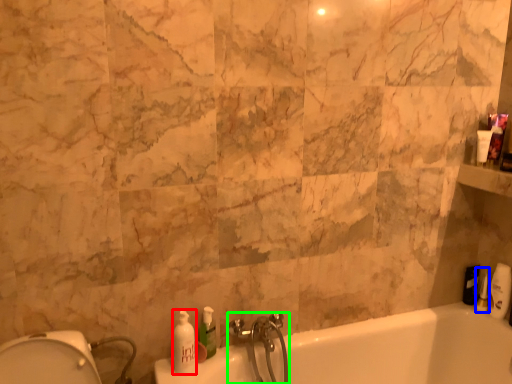
Question: Based on their relative distances, which object is nearer to soap dispenser (highlighted by a red box)? Choose from toiletry (highlighted by a blue box) and tap (highlighted by a green box).

Choices:
 (A) toiletry
 (B) tap

Answer: (B)